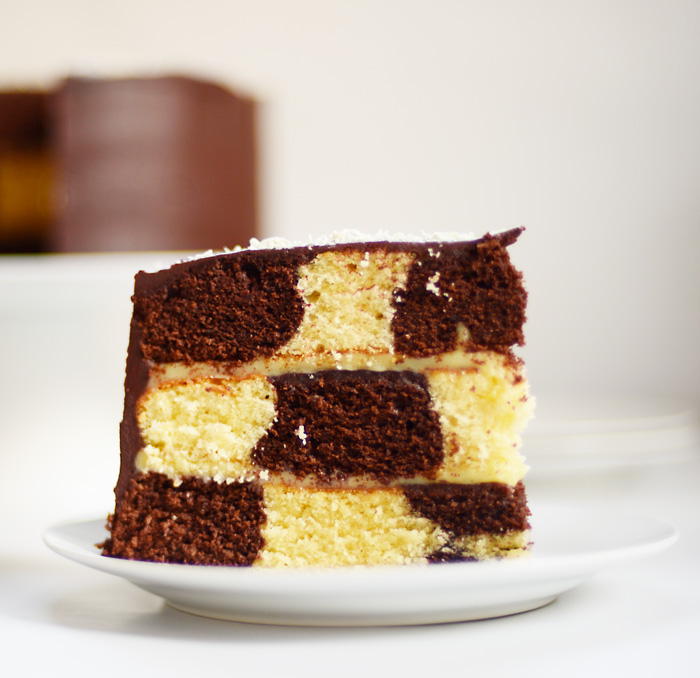
Where is `center of bottom of plate`? center of bottom of plate is located at coordinates (367, 624).